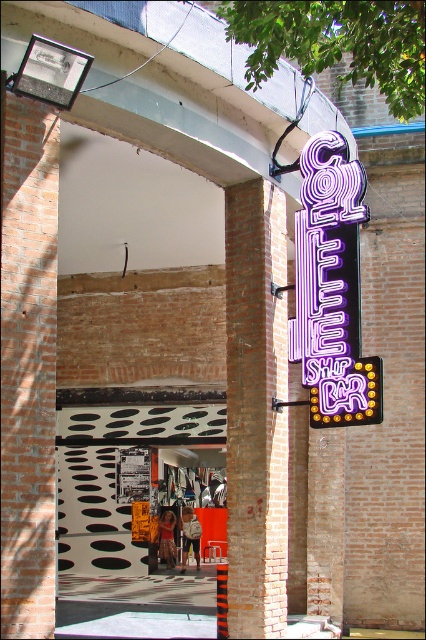
Does point (239, 541) come farther from viewer compared to point (330, 250)?

Yes, it is behind point (330, 250).

Locate an element on the screen. brick at center is located at coordinates (256, 410).

Is point (253, 417) positioned behind point (325, 378)?

Yes, point (253, 417) is farther from viewer.

This screenshot has height=640, width=426. Identify the location of brick at center. (256, 410).